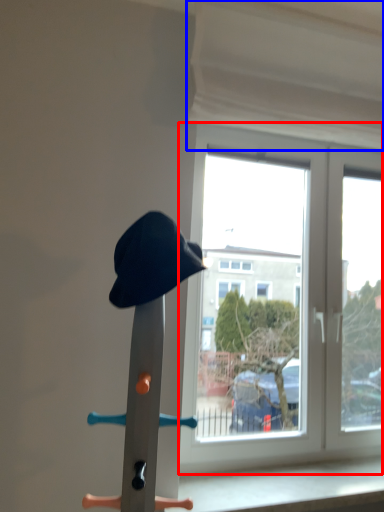
Question: Which of the following is the farthest to the observer, window (highlighted by a red box) or curtain (highlighted by a blue box)?

Choices:
 (A) window
 (B) curtain

Answer: (A)